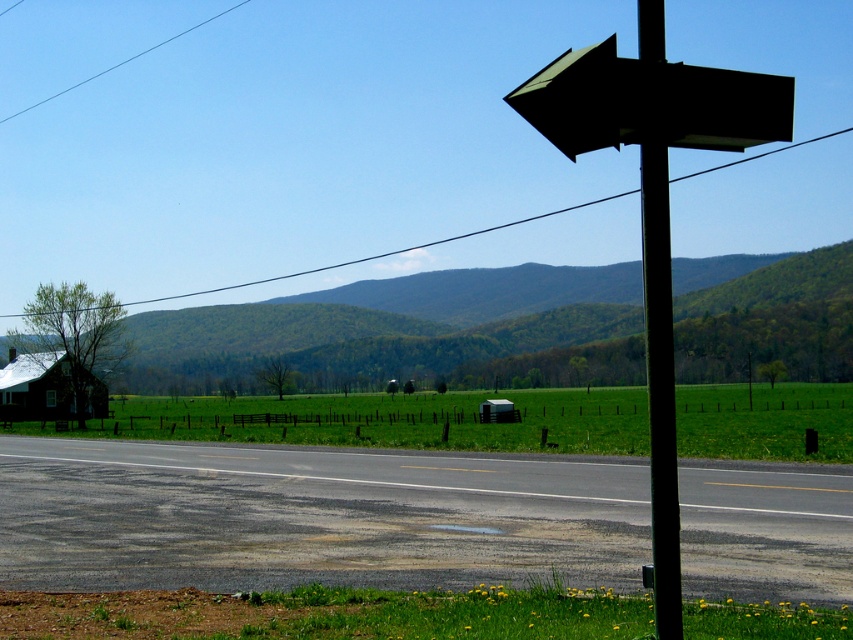
Question: Does green leafy mountain at center appear under black matte signpost at upper right?

Choices:
 (A) no
 (B) yes

Answer: (B)

Question: Can you confirm if dark green matte arrow at upper right is thinner than clear blue wire at upper left?

Choices:
 (A) yes
 (B) no

Answer: (A)

Question: Among these objects, which one is nearest to the camera?

Choices:
 (A) green leafy mountain at center
 (B) black matte arrow at upper right
 (C) black matte signpost at upper right

Answer: (B)

Question: Which point is farther to the camera?

Choices:
 (A) dark green matte arrow at upper right
 (B) green wire at upper center
 (C) brown wooden barn at lower left
 (D) black matte signpost at upper right

Answer: (B)

Question: Is black matte arrow at upper right to the left of green wire at upper center from the viewer's perspective?

Choices:
 (A) no
 (B) yes

Answer: (A)

Question: Which object is farther from the camera taking this photo?

Choices:
 (A) clear blue wire at upper left
 (B) dark green matte arrow at upper right
 (C) green wire at upper center
 (D) black matte arrow at upper right

Answer: (A)